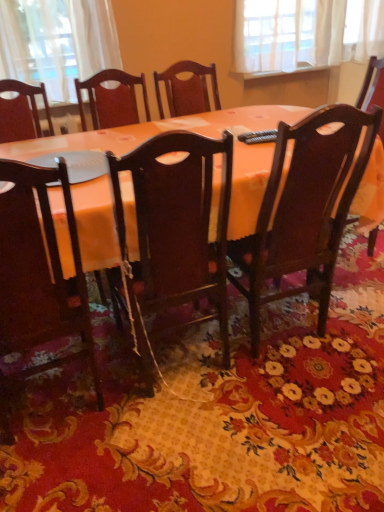
Where is `polished dark wood chair at center, the first chair viewed from the right`? The width and height of the screenshot is (384, 512). polished dark wood chair at center, the first chair viewed from the right is located at coordinates (305, 209).

Describe the element at coordinates (174, 230) in the screenshot. I see `wooden chair at center, placed as the second chair when sorted from right to left` at that location.

In order to click on matte dark wood chair at lower left, the 3th chair in the right-to-left sequence in this screenshot , I will do `click(37, 277)`.

Considering the relative sizes of polished dark wood chair at center, the first chair viewed from the right, and matte dark wood chair at lower left, the 3th chair in the right-to-left sequence, in the image provided, is polished dark wood chair at center, the first chair viewed from the right, shorter than matte dark wood chair at lower left, the 3th chair in the right-to-left sequence,?

Incorrect, the height of polished dark wood chair at center, the first chair viewed from the right, does not fall short of that of matte dark wood chair at lower left, the 3th chair in the right-to-left sequence.

From the image's perspective, which is above, polished dark wood chair at center, the first chair viewed from the right, or matte dark wood chair at lower left, the 3th chair in the right-to-left sequence?

polished dark wood chair at center, the first chair viewed from the right, from the image's perspective.

Could you tell me if polished dark wood chair at center, acting as the 3th chair starting from the left, is turned towards matte dark wood chair at lower left, marked as the 1th chair in a left-to-right arrangement?

No, polished dark wood chair at center, acting as the 3th chair starting from the left, does not turn towards matte dark wood chair at lower left, marked as the 1th chair in a left-to-right arrangement.

Is matte dark wood chair at lower left, marked as the 1th chair in a left-to-right arrangement, inside polished dark wood chair at center, the first chair viewed from the right?

No.

Can you tell me how much yellow fabric mat at center and matte dark wood chair at lower left, marked as the 1th chair in a left-to-right arrangement, differ in facing direction?

The angle between the facing direction of yellow fabric mat at center and the facing direction of matte dark wood chair at lower left, marked as the 1th chair in a left-to-right arrangement, is 179 degrees.

How far apart are yellow fabric mat at center and matte dark wood chair at lower left, marked as the 1th chair in a left-to-right arrangement?

yellow fabric mat at center is 21.73 inches from matte dark wood chair at lower left, marked as the 1th chair in a left-to-right arrangement.

Considering the relative positions of yellow fabric mat at center and matte dark wood chair at lower left, the 3th chair in the right-to-left sequence, in the image provided, is yellow fabric mat at center to the right of matte dark wood chair at lower left, the 3th chair in the right-to-left sequence, from the viewer's perspective?

Indeed, yellow fabric mat at center is positioned on the right side of matte dark wood chair at lower left, the 3th chair in the right-to-left sequence.

Is yellow fabric mat at center placed right next to matte dark wood chair at lower left, the 3th chair in the right-to-left sequence?

yellow fabric mat at center and matte dark wood chair at lower left, the 3th chair in the right-to-left sequence, are not in contact.

Is wooden chair at center, which appears as the second chair when viewed from the left, wider or thinner than yellow fabric mat at center?

Considering their sizes, wooden chair at center, which appears as the second chair when viewed from the left, looks slimmer than yellow fabric mat at center.

Is point (142, 276) farther from viewer compared to point (230, 417)?

No, (142, 276) is in front of (230, 417).

Could you measure the distance between wooden chair at center, placed as the second chair when sorted from right to left, and yellow fabric mat at center?

A distance of 34.63 centimeters exists between wooden chair at center, placed as the second chair when sorted from right to left, and yellow fabric mat at center.

From the image's perspective, which one is positioned higher, wooden chair at center, placed as the second chair when sorted from right to left, or yellow fabric mat at center?

wooden chair at center, placed as the second chair when sorted from right to left, appears higher in the image.

Is yellow fabric mat at center placed right next to matte orange table at center?

No, yellow fabric mat at center is not with matte orange table at center.

Which is in front, yellow fabric mat at center or matte orange table at center?

Positioned in front is yellow fabric mat at center.

Is yellow fabric mat at center not inside matte orange table at center?

Yes, yellow fabric mat at center is located beyond the bounds of matte orange table at center.

From the picture: From the image's perspective, which one is positioned higher, yellow fabric mat at center or matte orange table at center?

From the image's view, matte orange table at center is above.

Considering the positions of objects yellow fabric mat at center and wooden chair at center, which appears as the second chair when viewed from the left, in the image provided, who is in front, yellow fabric mat at center or wooden chair at center, which appears as the second chair when viewed from the left,?

yellow fabric mat at center.

Which object is positioned more to the right, yellow fabric mat at center or wooden chair at center, which appears as the second chair when viewed from the left?

From the viewer's perspective, yellow fabric mat at center appears more on the right side.

Is point (46, 373) positioned behind point (182, 205)?

Yes.

Does yellow fabric mat at center have a lesser width compared to wooden chair at center, placed as the second chair when sorted from right to left?

No, yellow fabric mat at center is not thinner than wooden chair at center, placed as the second chair when sorted from right to left.

Could you tell me if matte dark wood chair at lower left, the 3th chair in the right-to-left sequence, is turned towards yellow fabric mat at center?

No, matte dark wood chair at lower left, the 3th chair in the right-to-left sequence, does not turn towards yellow fabric mat at center.

From a real-world perspective, is matte dark wood chair at lower left, marked as the 1th chair in a left-to-right arrangement, located higher than yellow fabric mat at center?

Yes, from a real-world perspective, matte dark wood chair at lower left, marked as the 1th chair in a left-to-right arrangement, is on top of yellow fabric mat at center.

How many degrees apart are the facing directions of matte dark wood chair at lower left, the 3th chair in the right-to-left sequence, and yellow fabric mat at center?

They differ by 179 degrees in their facing directions.

Does matte dark wood chair at lower left, the 3th chair in the right-to-left sequence, have a greater width compared to yellow fabric mat at center?

Incorrect, the width of matte dark wood chair at lower left, the 3th chair in the right-to-left sequence, does not surpass that of yellow fabric mat at center.

Is polished dark wood chair at center, the first chair viewed from the right, shorter than matte orange table at center?

In fact, polished dark wood chair at center, the first chair viewed from the right, may be taller than matte orange table at center.

Does point (263, 257) lie in front of point (112, 243)?

No, it is not.

Between polished dark wood chair at center, acting as the 3th chair starting from the left, and matte orange table at center, which one appears on the right side from the viewer's perspective?

polished dark wood chair at center, acting as the 3th chair starting from the left.

In the scene shown: From the image's perspective, would you say polished dark wood chair at center, the first chair viewed from the right, is positioned over matte orange table at center?

No.

From the matte dark wood chair at lower left, the 3th chair in the right-to-left sequence, count 2nd chair to the right and point to it. Please provide its 2D coordinates.

[(305, 209)]

The height and width of the screenshot is (512, 384). In order to click on mat lying behind the matte dark wood chair at lower left, the 3th chair in the right-to-left sequence in this screenshot , I will do `click(218, 414)`.

Estimate the real-world distances between objects in this image. Which object is closer to polished dark wood chair at center, the first chair viewed from the right, matte dark wood chair at lower left, the 3th chair in the right-to-left sequence, or wooden chair at center, placed as the second chair when sorted from right to left?

wooden chair at center, placed as the second chair when sorted from right to left.

Considering their positions, is matte dark wood chair at lower left, the 3th chair in the right-to-left sequence, positioned further to wooden chair at center, which appears as the second chair when viewed from the left, than polished dark wood chair at center, acting as the 3th chair starting from the left?

polished dark wood chair at center, acting as the 3th chair starting from the left, is further to wooden chair at center, which appears as the second chair when viewed from the left.

Looking at the image, which one is located further to polished dark wood chair at center, acting as the 3th chair starting from the left, yellow fabric mat at center or matte orange table at center?

The object further to polished dark wood chair at center, acting as the 3th chair starting from the left, is yellow fabric mat at center.

Estimate the real-world distances between objects in this image. Which object is closer to polished dark wood chair at center, the first chair viewed from the right, wooden chair at center, which appears as the second chair when viewed from the left, or matte orange table at center?

Among the two, wooden chair at center, which appears as the second chair when viewed from the left, is located nearer to polished dark wood chair at center, the first chair viewed from the right.

Estimate the real-world distances between objects in this image. Which object is further from matte dark wood chair at lower left, marked as the 1th chair in a left-to-right arrangement, yellow fabric mat at center or matte orange table at center?

Based on the image, yellow fabric mat at center appears to be further to matte dark wood chair at lower left, marked as the 1th chair in a left-to-right arrangement.

When comparing their distances from yellow fabric mat at center, does polished dark wood chair at center, the first chair viewed from the right, or matte orange table at center seem closer?

polished dark wood chair at center, the first chair viewed from the right, lies closer to yellow fabric mat at center than the other object.

Estimate the real-world distances between objects in this image. Which object is further from matte orange table at center, polished dark wood chair at center, acting as the 3th chair starting from the left, or wooden chair at center, placed as the second chair when sorted from right to left?

polished dark wood chair at center, acting as the 3th chair starting from the left, is further to matte orange table at center.

Considering their positions, is polished dark wood chair at center, the first chair viewed from the right, positioned closer to matte dark wood chair at lower left, marked as the 1th chair in a left-to-right arrangement, than yellow fabric mat at center?

yellow fabric mat at center lies closer to matte dark wood chair at lower left, marked as the 1th chair in a left-to-right arrangement, than the other object.

Identify the location of chair located between wooden chair at center, which appears as the second chair when viewed from the left, and yellow fabric mat at center in the left-right direction. (305, 209).

Where is `table between wooden chair at center, which appears as the second chair when viewed from the left, and yellow fabric mat at center, in the horizontal direction`? table between wooden chair at center, which appears as the second chair when viewed from the left, and yellow fabric mat at center, in the horizontal direction is located at coordinates (159, 131).

The image size is (384, 512). Identify the location of table situated between matte dark wood chair at lower left, marked as the 1th chair in a left-to-right arrangement, and yellow fabric mat at center from left to right. (159, 131).

The image size is (384, 512). I want to click on chair between matte dark wood chair at lower left, the 3th chair in the right-to-left sequence, and polished dark wood chair at center, acting as the 3th chair starting from the left, in the horizontal direction, so click(x=174, y=230).